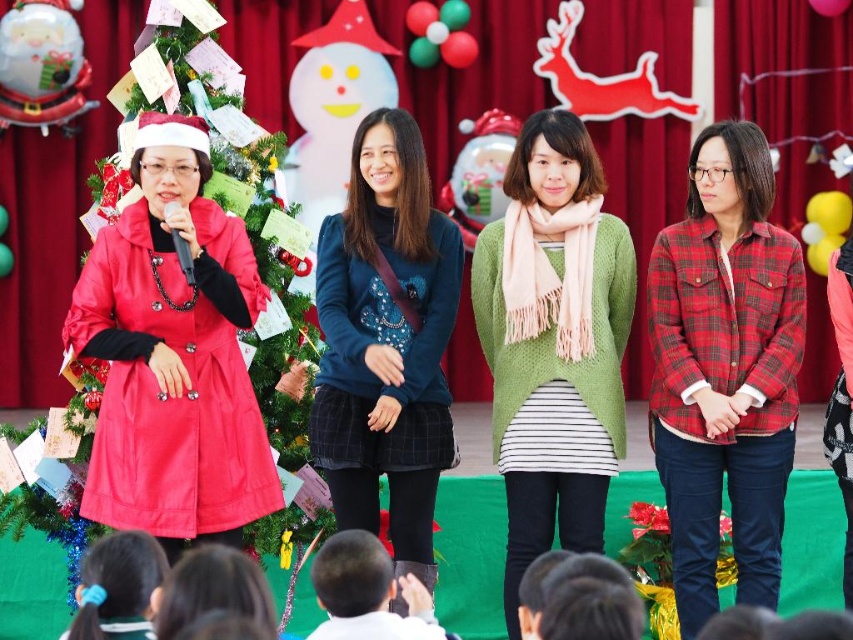
Question: Is red plaid shirt at center further to camera compared to green knitted sweater at center?

Choices:
 (A) no
 (B) yes

Answer: (A)

Question: Which point is farther to the camera?

Choices:
 (A) matte red coat at left
 (B) green knitted sweater at center

Answer: (B)

Question: Which object appears closest to the camera in this image?

Choices:
 (A) green knitted sweater at center
 (B) matte red coat at left
 (C) dark blue sweater at center
 (D) red plaid shirt at center

Answer: (B)

Question: Does green knitted sweater at center appear on the left side of dark blue sweater at center?

Choices:
 (A) yes
 (B) no

Answer: (B)

Question: Which object is closer to the camera taking this photo?

Choices:
 (A) matte red coat at left
 (B) green knitted sweater at center

Answer: (A)

Question: From the image, what is the correct spatial relationship of green knitted sweater at center in relation to dark blue sweater at center?

Choices:
 (A) below
 (B) above

Answer: (A)